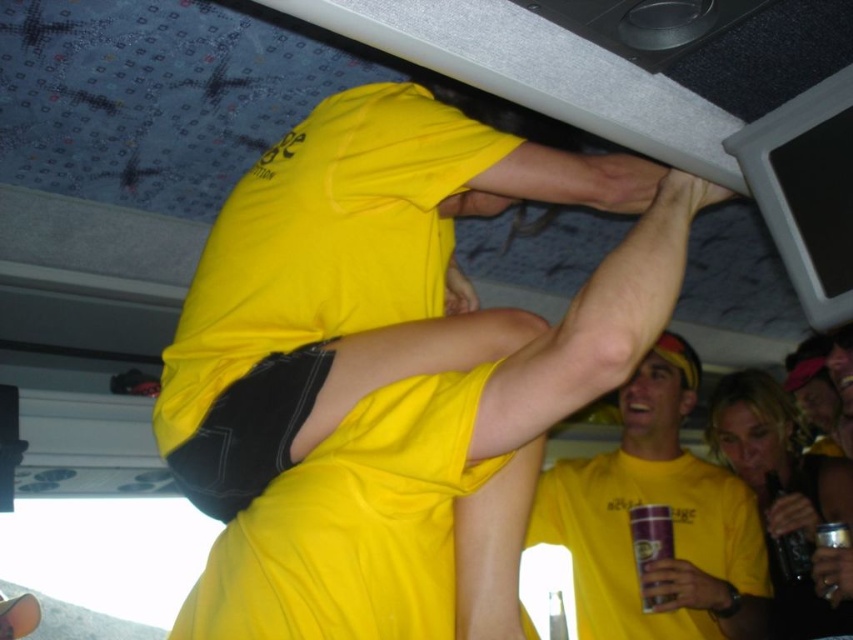
Consider the image. You are standing at the center of the room and want to move towards the two points marked in the image. Which point, point [216,333] or point [807,577], is closer to you?

→ Point [216,333] is closer to you because it is in front of point [807,577].